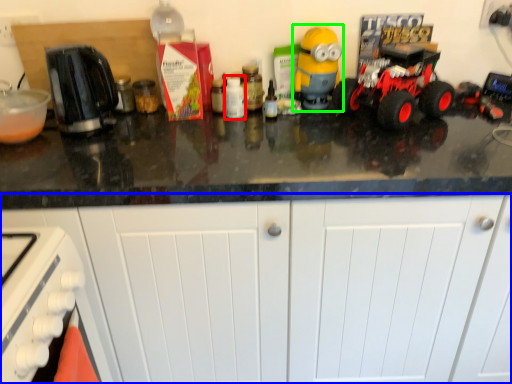
Question: Based on their relative distances, which object is farther from bottle (highlighted by a red box)? Choose from cabinetry (highlighted by a blue box) and toy (highlighted by a green box).

Choices:
 (A) cabinetry
 (B) toy

Answer: (A)